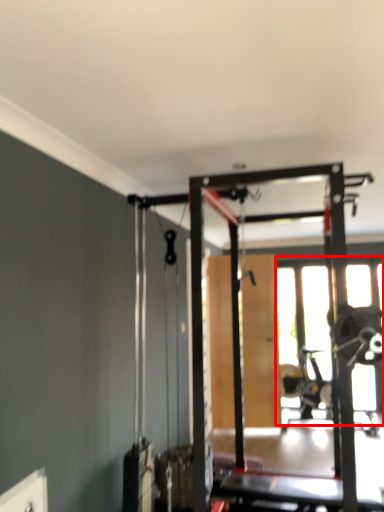
Question: Observing the image, what is the correct spatial positioning of window (annotated by the red box) in reference to screen door?

Choices:
 (A) right
 (B) left

Answer: (A)